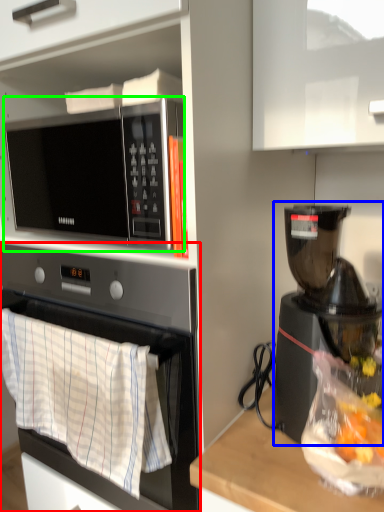
Question: Estimate the real-world distances between objects in this image. Which object is farther from oven (highlighted by a red box), coffee maker (highlighted by a blue box) or microwave oven (highlighted by a green box)?

Choices:
 (A) coffee maker
 (B) microwave oven

Answer: (A)